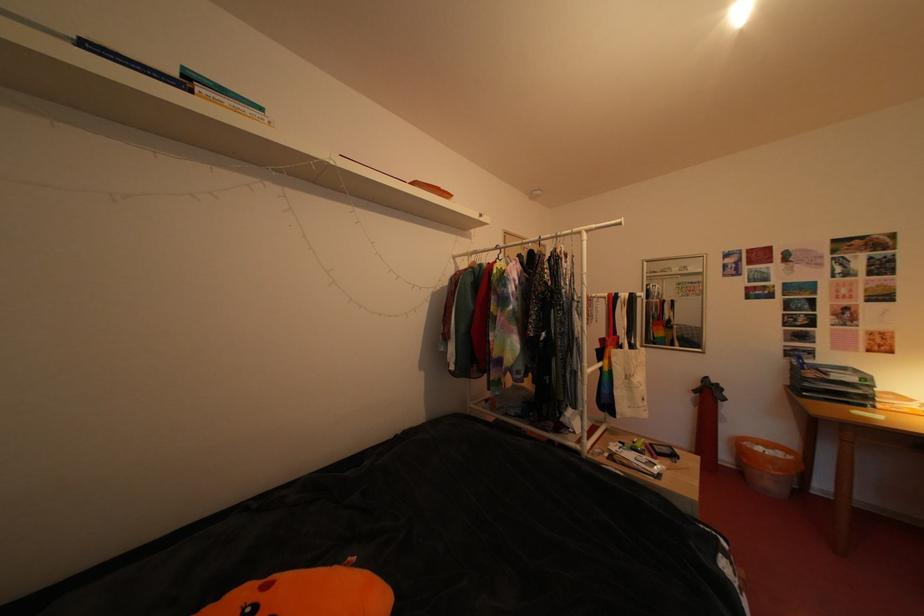
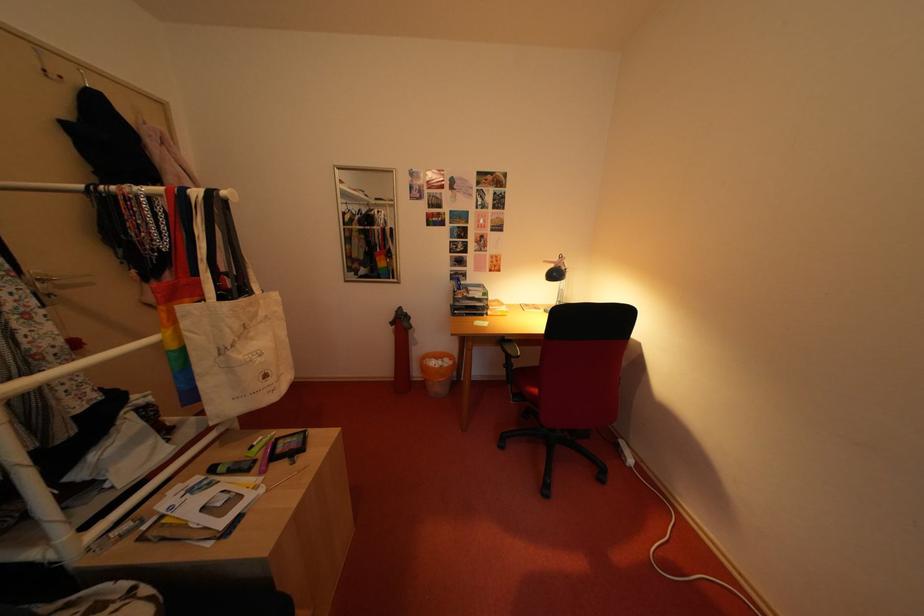
The point at [616,374] is marked in the first image. Where is the corresponding point in the second image?

(184, 352)